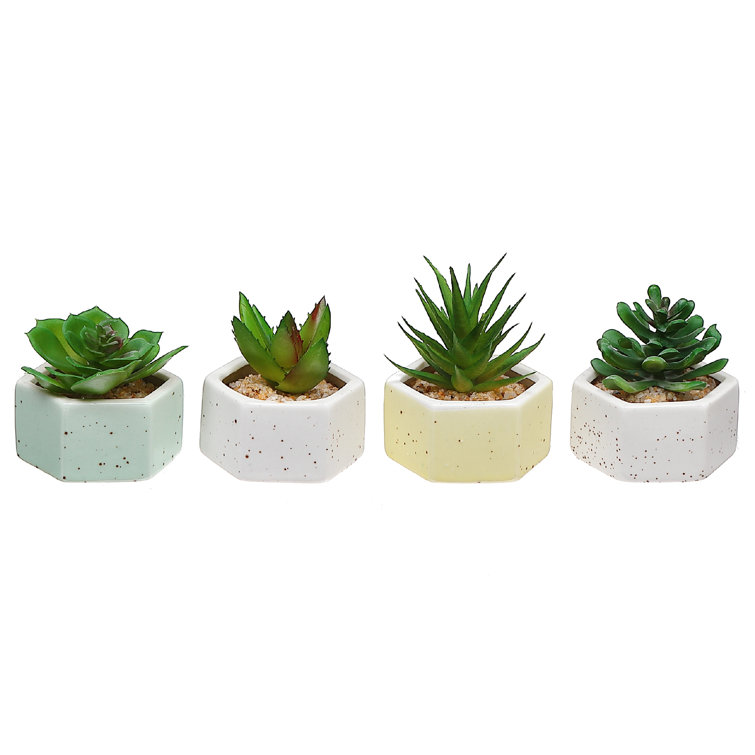
At what (x,y) coordinates should I click in order to perform the action: click on most yellow planter. Please return your answer as a coordinate pair (x, y). This screenshot has height=755, width=755. Looking at the image, I should click on (469, 433).